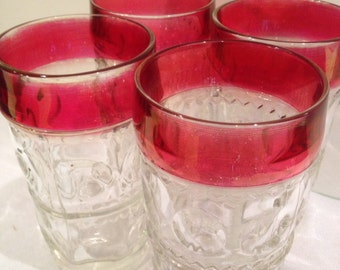
Where is `inside of a drinking glass`? Image resolution: width=340 pixels, height=270 pixels. inside of a drinking glass is located at coordinates (214, 107).